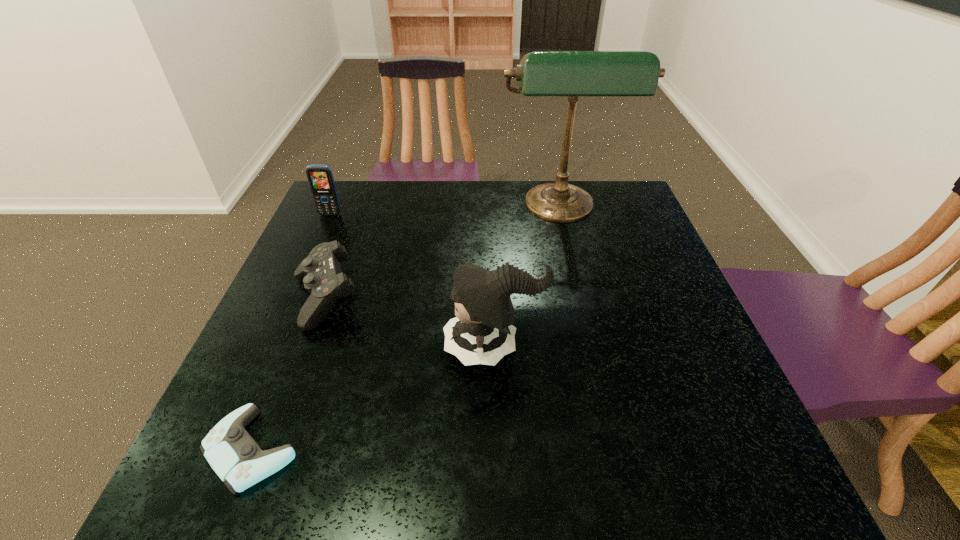
Where is `vacant space that is in between the tallest object and the taller control`? The image size is (960, 540). vacant space that is in between the tallest object and the taller control is located at coordinates (443, 254).

I want to click on free space between the cellular telephone and the second tallest object, so click(412, 281).

Locate an element on the screen. vacant region between the taller control and the doll is located at coordinates (409, 324).

The height and width of the screenshot is (540, 960). I want to click on empty location between the cellular telephone and the nearest object, so click(291, 332).

The height and width of the screenshot is (540, 960). In order to click on free space between the table lamp and the nearest object in this screenshot , I will do `click(406, 329)`.

Image resolution: width=960 pixels, height=540 pixels. What are the coordinates of `vacant space in between the fourth shortest object and the third shortest object` in the screenshot? It's located at (412, 281).

This screenshot has height=540, width=960. Identify the location of free space between the fourth tallest object and the doll. (409, 324).

In order to click on free spot between the third shortest object and the table lamp in this screenshot , I will do [445, 212].

Identify the location of vacant area that lies between the third shortest object and the shorter control. point(291,332).

The image size is (960, 540). Find the location of `object that is the second nearest to the third tallest object`. object that is the second nearest to the third tallest object is located at coordinates (541, 73).